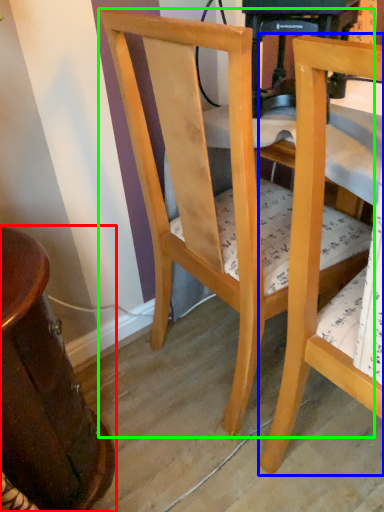
Question: Which is farther away from table (highlighted by a red box)? chair (highlighted by a blue box) or chair (highlighted by a green box)?

Choices:
 (A) chair
 (B) chair

Answer: (A)